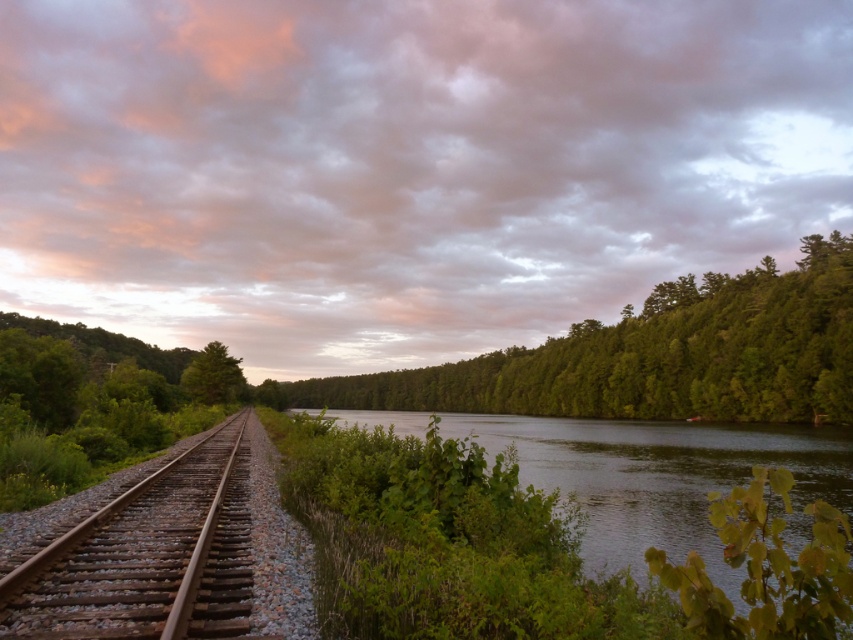
You are standing at the point labeled point (541, 548) on the image. Based on the scene description, what type of terrain or feature would you most likely be standing on?

The point (541, 548) corresponds to the green leafy river at center, so you would be standing on a river.

You are standing at the origin point of the image. Which direction should you move to reach the green leafy river at center?

The green leafy river at center is located at coordinates point (541,548), so you should move towards the direction of increasing x and y coordinates to reach it.

You are a photographer standing at the edge of the green leafy river at center and want to capture the green matte tree at center in your shot. Based on their heights, will the tree appear taller than the river in your photograph?

The green leafy river at center is not as tall as the green matte tree at center, so the tree will appear taller than the river in the photograph.